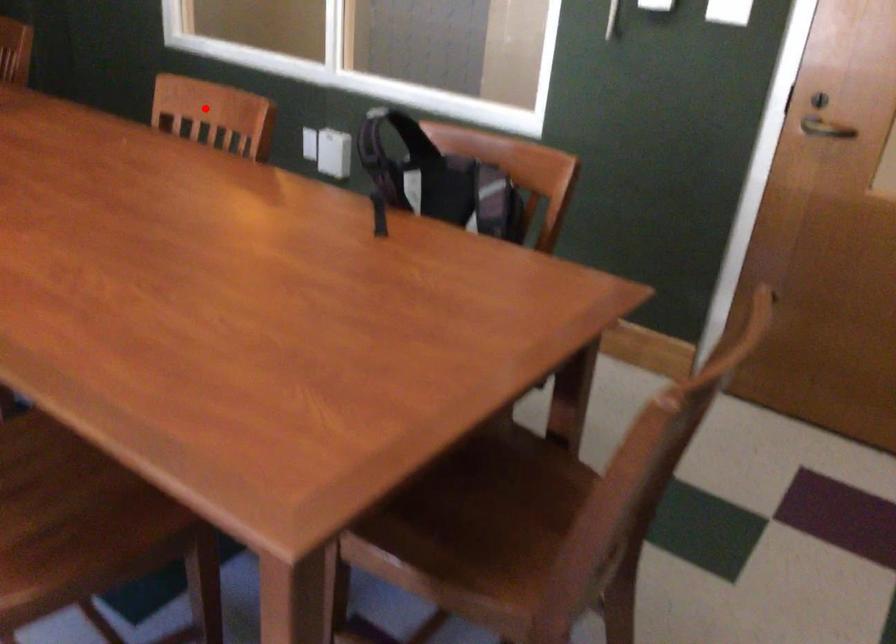
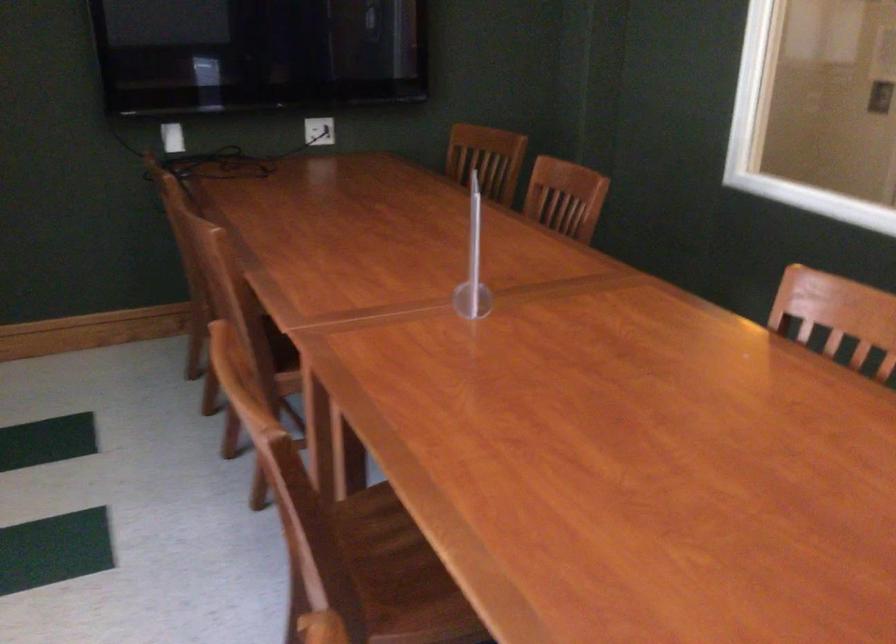
The point at the highlighted location is marked in the first image. Where is the corresponding point in the second image?

(841, 313)